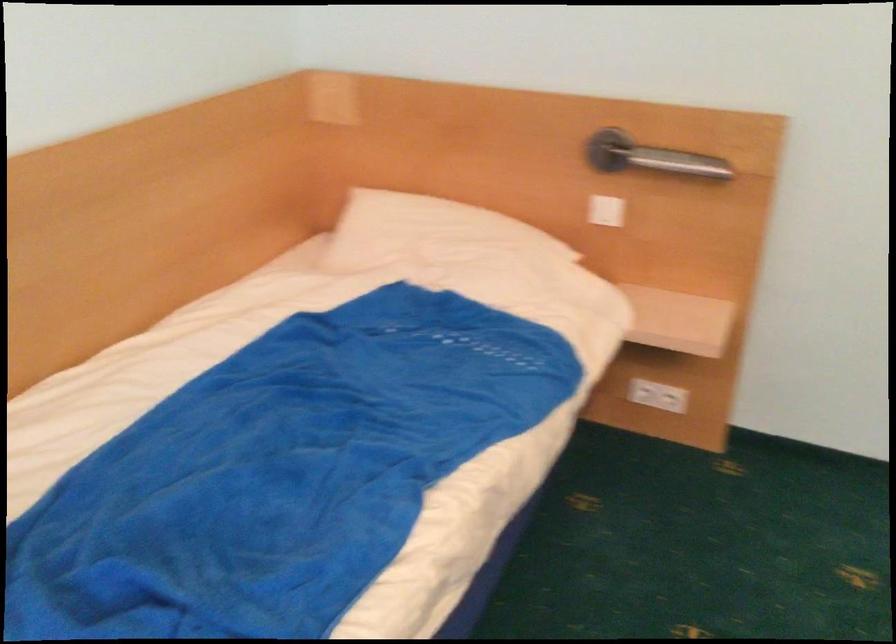
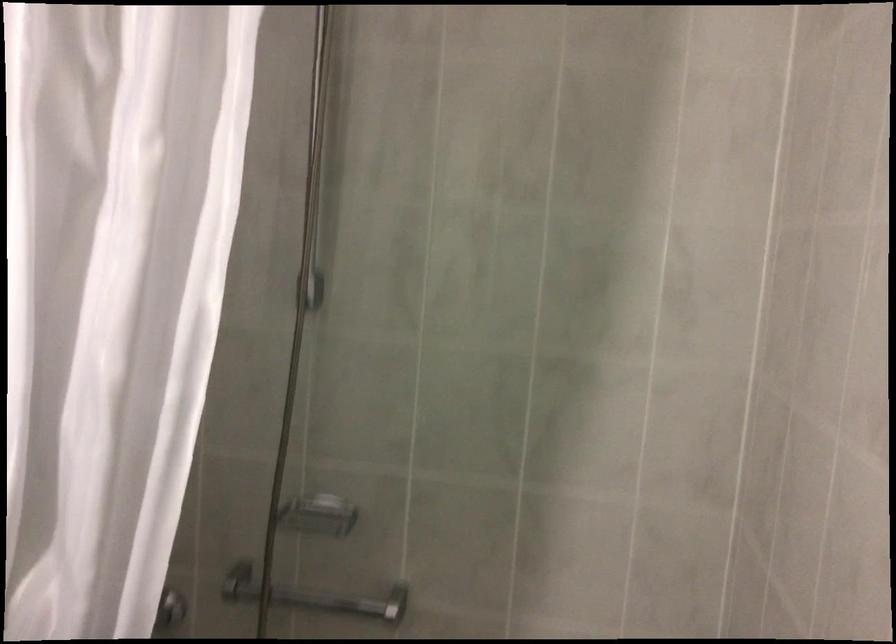
From the picture: In a continuous first-person perspective shot, in which direction is the camera moving?

The movement direction of the cameraman is right, forward.